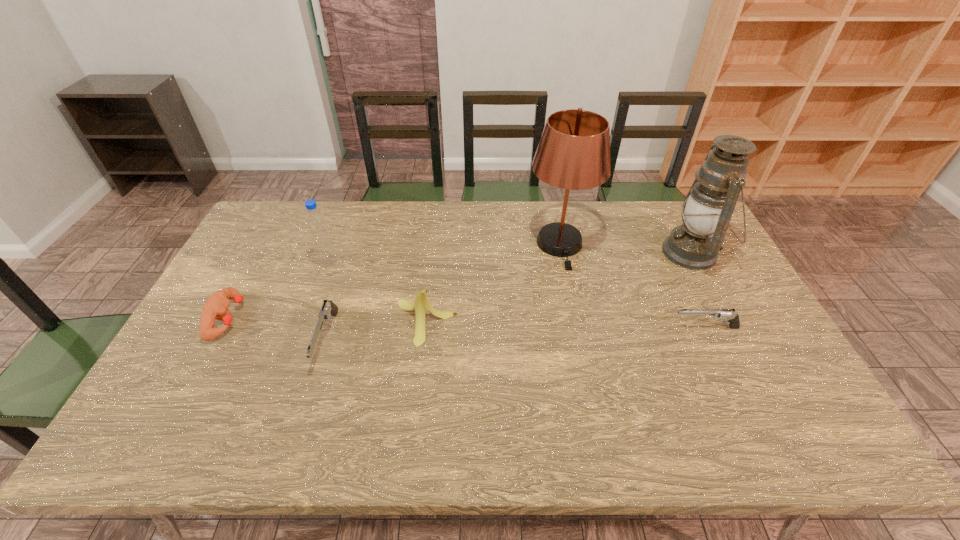
You are a GUI agent. You are given a task and a screenshot of the screen. Output one action in this format:
    pyautogui.click(x=<x>, y=<y>)
    Task: Click on the free space for an extra pistol to achieve even spacing
    The image size is (960, 540).
    Given the screenshot: What is the action you would take?
    pyautogui.click(x=518, y=334)